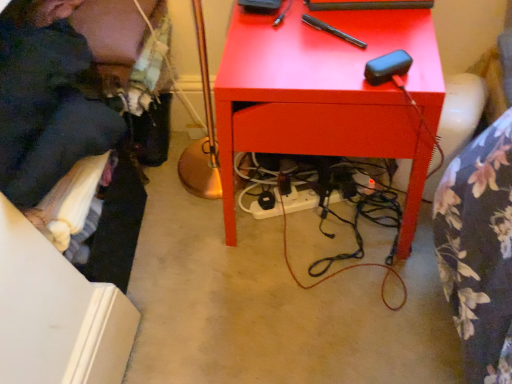
This screenshot has height=384, width=512. Describe the element at coordinates (328, 96) in the screenshot. I see `matte red desk at center` at that location.

Locate an element on the screen. The width and height of the screenshot is (512, 384). matte red desk at center is located at coordinates (328, 96).

Measure the distance between matte red desk at center and camera.

The distance of matte red desk at center from camera is 63.63 centimeters.

At what (x,y) coordinates should I click in order to perform the action: click on dark blue fabric at left. Please return your answer as a coordinate pair (x, y). Looking at the image, I should click on (46, 101).

What do you see at coordinates (46, 101) in the screenshot? Image resolution: width=512 pixels, height=384 pixels. I see `dark blue fabric at left` at bounding box center [46, 101].

Find the location of a particular element. Image resolution: width=512 pixels, height=384 pixels. matte red desk at center is located at coordinates (328, 96).

Between dark blue fabric at left and matte red desk at center, which one appears on the right side from the viewer's perspective?

Positioned to the right is matte red desk at center.

Which object is more forward, dark blue fabric at left or matte red desk at center?

matte red desk at center is more forward.

Does point (86, 61) lie behind point (304, 54)?

That is True.

Based on the photo, from the image's perspective, is dark blue fabric at left positioned above or below matte red desk at center?

dark blue fabric at left is situated higher than matte red desk at center in the image.

From a real-world perspective, is dark blue fabric at left on top of matte red desk at center?

Yes, from a real-world perspective, dark blue fabric at left is above matte red desk at center.

Does dark blue fabric at left have a greater width compared to matte red desk at center?

No.

Does dark blue fabric at left have a greater height compared to matte red desk at center?

Yes.

Between dark blue fabric at left and matte red desk at center, which one has larger size?

Bigger between the two is matte red desk at center.

Can matte red desk at center be found inside dark blue fabric at left?

That's incorrect, matte red desk at center is not inside dark blue fabric at left.

Are dark blue fabric at left and matte red desk at center located far from each other?

They are positioned close to each other.

Could you tell me if dark blue fabric at left is turned towards matte red desk at center?

Yes, dark blue fabric at left is aimed at matte red desk at center.

How distant is dark blue fabric at left from matte red desk at center?

14.67 inches.

This screenshot has width=512, height=384. Find the location of `desk that is in front of the dark blue fabric at left`. desk that is in front of the dark blue fabric at left is located at coordinates (328, 96).

In the image, is matte red desk at center on the left side or the right side of dark blue fabric at left?

In the image, matte red desk at center appears on the right side of dark blue fabric at left.

In the image, is matte red desk at center positioned in front of or behind dark blue fabric at left?

→ Visually, matte red desk at center is located in front of dark blue fabric at left.

Is point (258, 31) positioned behind point (57, 73)?

That is True.

From the image's perspective, is matte red desk at center located above dark blue fabric at left?

No, from the image's perspective, matte red desk at center is not on top of dark blue fabric at left.

Looking at this image, from a real-world perspective, which is physically below, matte red desk at center or dark blue fabric at left?

matte red desk at center.

Which of these two, matte red desk at center or dark blue fabric at left, is wider?

With larger width is matte red desk at center.

Which of these two, matte red desk at center or dark blue fabric at left, stands shorter?

With less height is matte red desk at center.

Considering the sizes of matte red desk at center and dark blue fabric at left in the image, is matte red desk at center bigger or smaller than dark blue fabric at left?

Considering their sizes, matte red desk at center takes up more space than dark blue fabric at left.

Is matte red desk at center not inside dark blue fabric at left?

Yes, matte red desk at center is outside of dark blue fabric at left.

Would you say matte red desk at center is a long distance from dark blue fabric at left?

Actually, matte red desk at center and dark blue fabric at left are a little close together.

Is matte red desk at center positioned with its back to dark blue fabric at left?

No, matte red desk at center is not facing the opposite direction of dark blue fabric at left.

How different are the orientations of matte red desk at center and dark blue fabric at left in degrees?

They differ by 89.4 degrees in their facing directions.

Identify the location of desk below the dark blue fabric at left (from a real-world perspective). (328, 96).

Locate an element on the screen. This screenshot has width=512, height=384. desk in front of the dark blue fabric at left is located at coordinates (328, 96).

In order to click on desk below the dark blue fabric at left (from a real-world perspective) in this screenshot , I will do `click(328, 96)`.